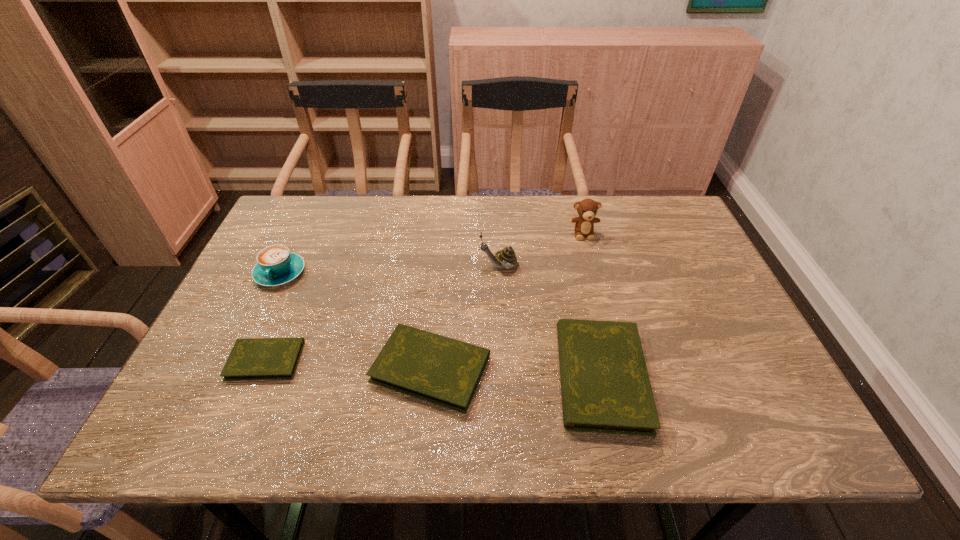
Please point a vacant point for placing a diary on the right. Please provide its 2D coordinates. Your answer should be formatted as a tuple, i.e. [(x, y)], where the tuple contains the x and y coordinates of a point satisfying the conditions above.

[(777, 385)]